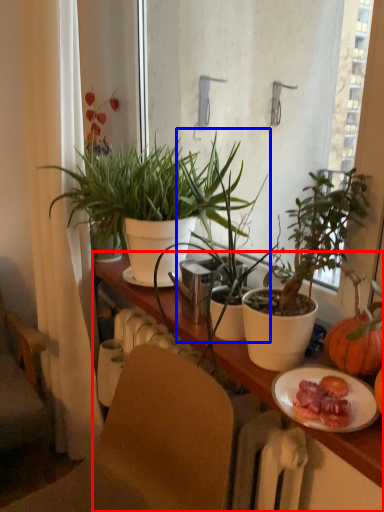
Question: Which object appears closest to the camera in this image, cabinetry (highlighted by a red box) or houseplant (highlighted by a blue box)?

Choices:
 (A) cabinetry
 (B) houseplant

Answer: (A)